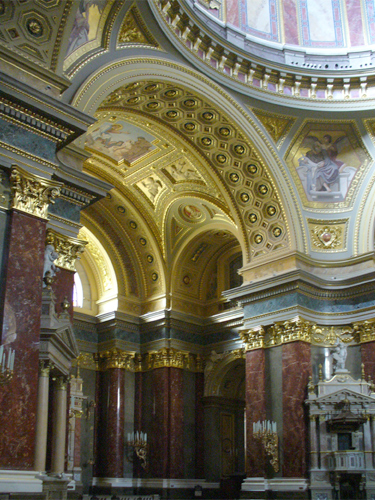
You are a GUI agent. You are given a task and a screenshot of the screen. Output one action in this format:
    pyautogui.click(x=<x>, y=<y>)
    Task: Click on the tan beams
    
    Given the screenshot: What is the action you would take?
    pyautogui.click(x=41, y=416), pyautogui.click(x=65, y=413)